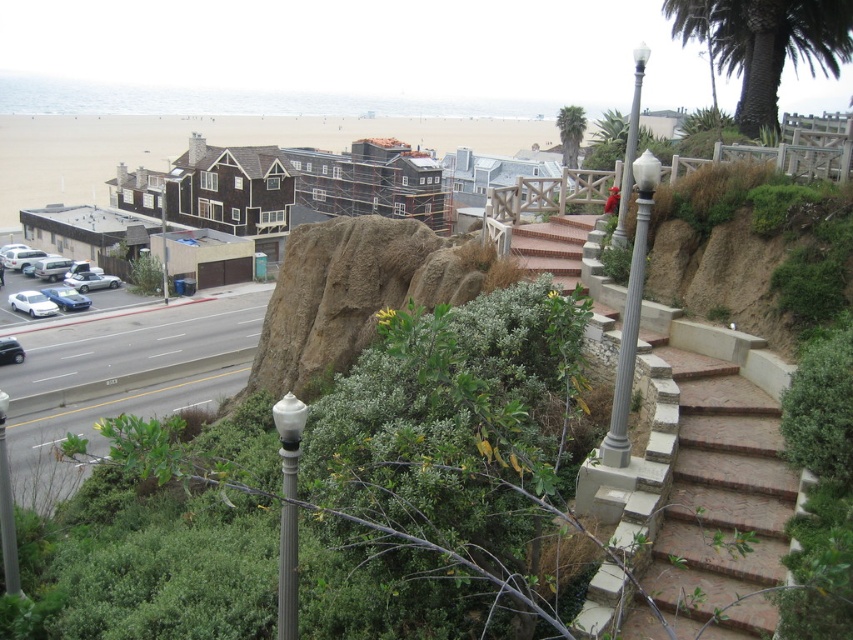
Consider the image. Between brick stairs at right and white textured lamp post at center-right, which one has less height?

brick stairs at right is shorter.

The height and width of the screenshot is (640, 853). I want to click on brick stairs at right, so click(x=699, y=464).

Can you confirm if green leafy palm tree at upper right is positioned above white matte car at lower left?

Correct, green leafy palm tree at upper right is located above white matte car at lower left.

Between point (769, 125) and point (39, 316), which one is positioned in front?

Point (769, 125) is more forward.

Locate an element on the screen. This screenshot has width=853, height=640. green leafy palm tree at upper right is located at coordinates (764, 44).

Does white matte car at lower left have a greater width compared to brushed metal pole at center?

In fact, white matte car at lower left might be narrower than brushed metal pole at center.

Between point (21, 307) and point (163, 234), which one is positioned behind?

The point (163, 234) is more distant.

Where is `white matte car at lower left`? The width and height of the screenshot is (853, 640). white matte car at lower left is located at coordinates (32, 304).